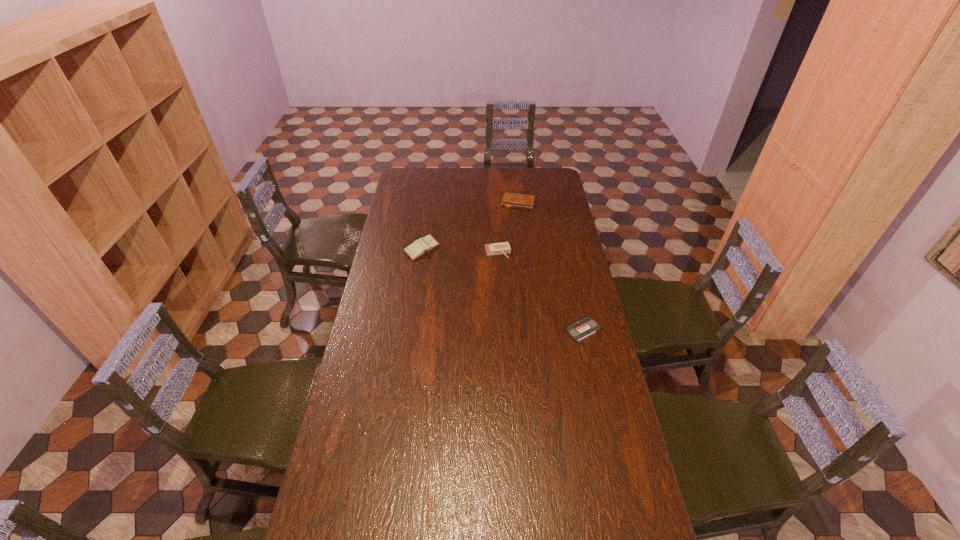
Identify the location of free spot on the desktop that is between the taller diary and the nearest object and is positioned on the spine side of the farther diary. (496, 287).

You are a GUI agent. You are given a task and a screenshot of the screen. Output one action in this format:
    pyautogui.click(x=<x>, y=<y>)
    Task: Click on the free space on the desktop that is between the left diary and the nearest object and is positioned on the striking surface of the third shortest object
    The image size is (960, 540).
    Given the screenshot: What is the action you would take?
    (x=513, y=295)